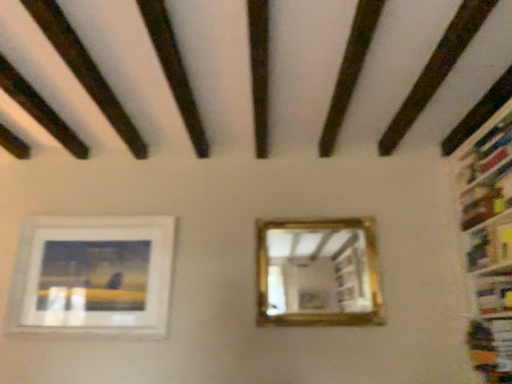
Question: Is point (354, 307) positioned closer to the camera than point (100, 99)?

Choices:
 (A) farther
 (B) closer

Answer: (A)

Question: From the image's perspective, relative to dark brown wood at upper left, is gold-framed mirror at center above or below?

Choices:
 (A) above
 (B) below

Answer: (B)

Question: Considering the real-world distances, which object is farthest from the white matte picture frame at lower left?

Choices:
 (A) dark brown wood at upper left
 (B) hardcover book at right, which appears as the second book when ordered from the bottom
 (C) hardcover book at right, which appears as the second book when viewed from the top
 (D) gold-framed mirror at center

Answer: (C)

Question: Which object is the closest to the hardcover book at right, which appears as the second book when viewed from the top?

Choices:
 (A) hardcover book at right, which appears as the second book when ordered from the bottom
 (B) white matte picture frame at lower left
 (C) gold-framed mirror at center
 (D) dark brown wood at upper left

Answer: (A)